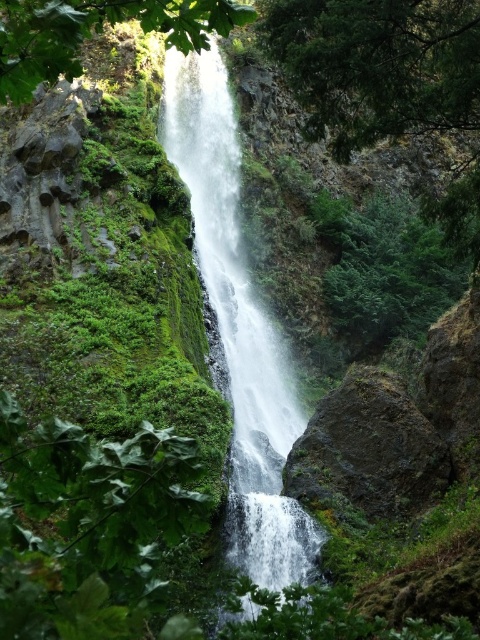
You are an ornithologist observing the waterfall area. You notice two green leafy trees in the upper part of the scene. Which tree would provide a better vantage point for observing the waterfall from above? Please choose between the green leafy tree at upper right and the green leafy tree at upper center.

The green leafy tree at upper right is larger in size than the green leafy tree at upper center, so it would provide a better vantage point for observing the waterfall from above.